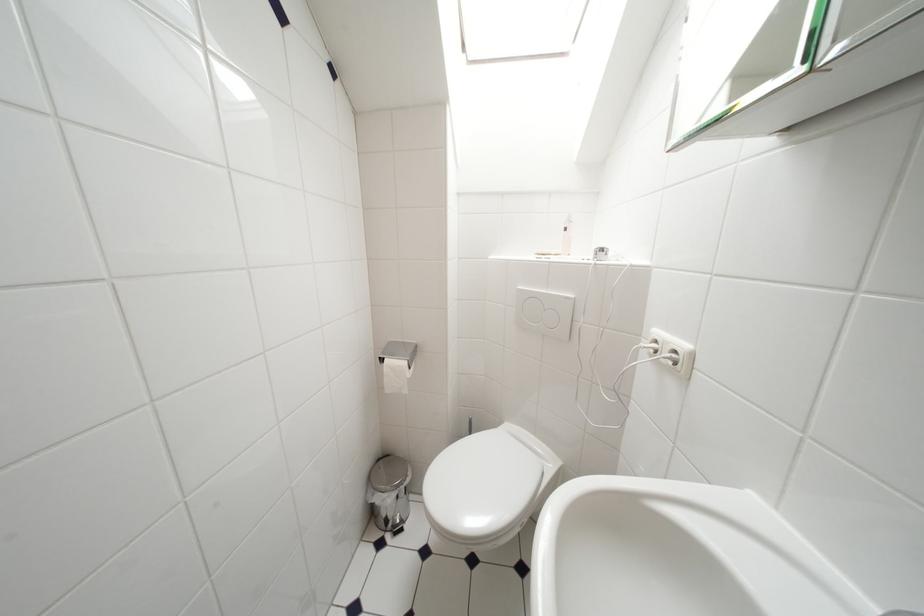
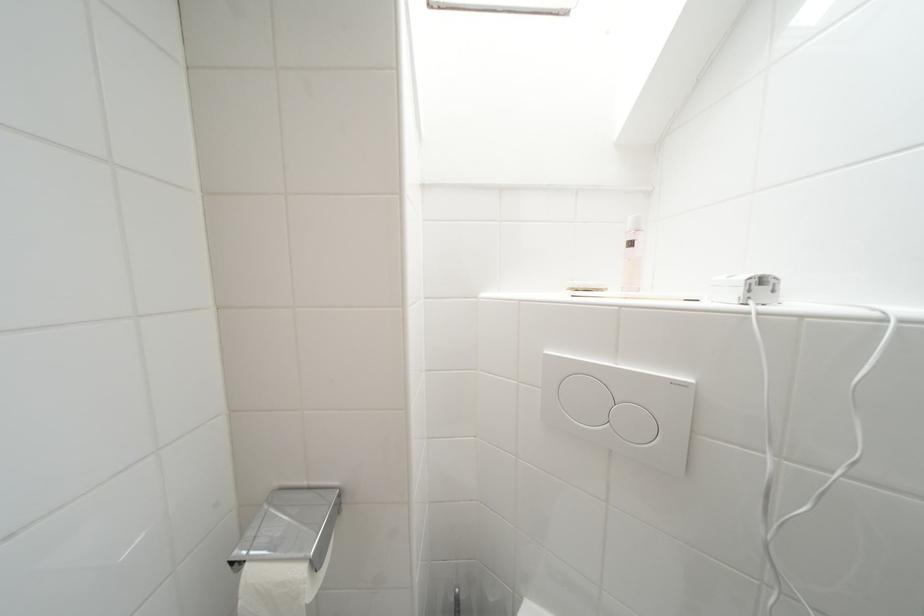
Where in the second image is the point corresponding to point 409,346 from the first image?

(315, 491)